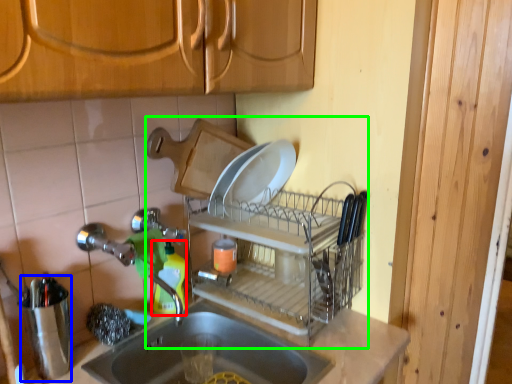
Question: Estimate the real-world distances between objects in this image. Which object is closer to bottle (highlighted by a red box), appliance (highlighted by a blue box) or dish washer (highlighted by a green box)?

Choices:
 (A) appliance
 (B) dish washer

Answer: (B)